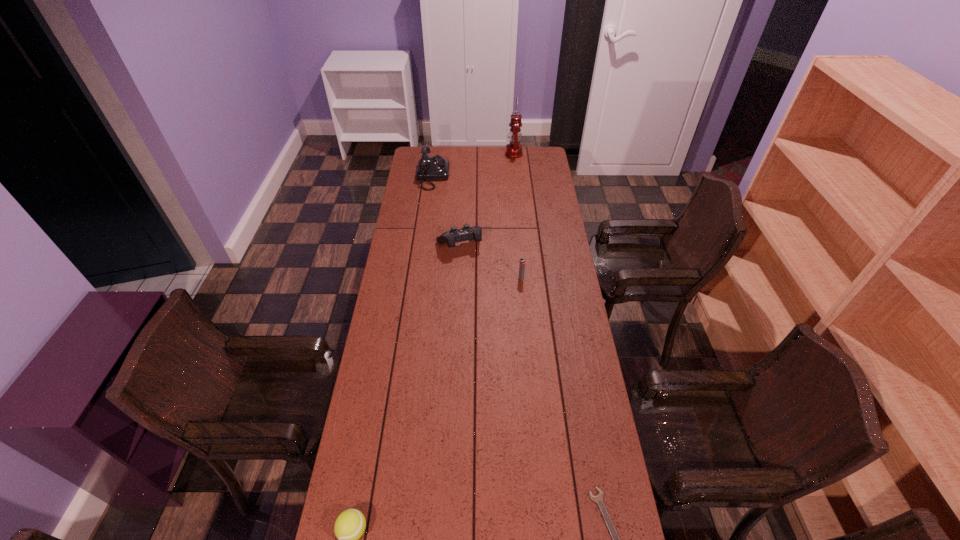
Identify the location of oil lamp. (514, 149).

Where is `the tallest object`? The height and width of the screenshot is (540, 960). the tallest object is located at coordinates (514, 149).

Find the location of a particular element. the second tallest object is located at coordinates (430, 168).

Image resolution: width=960 pixels, height=540 pixels. Identify the location of the fifth nearest object. (430, 168).

Locate an element on the screen. the third nearest object is located at coordinates (522, 262).

You are a GUI agent. You are given a task and a screenshot of the screen. Output one action in this format:
    pyautogui.click(x=<x>, y=<y>)
    Task: Click on the fourth nearest object
    The height and width of the screenshot is (540, 960).
    Given the screenshot: What is the action you would take?
    pyautogui.click(x=466, y=233)

Locate an element on the screen. vacant space located 0.160m on the left of the tallest object is located at coordinates (477, 153).

You are a GUI agent. You are given a task and a screenshot of the screen. Output one action in this format:
    pyautogui.click(x=<x>, y=<y>)
    Task: Click on the vacant space situated on the dial of the telephone
    The height and width of the screenshot is (540, 960).
    Given the screenshot: What is the action you would take?
    pyautogui.click(x=490, y=177)

Find the location of `vacant region located on the front of the third nearest object`. vacant region located on the front of the third nearest object is located at coordinates (528, 356).

Where is `vacant region located on the right of the fourth nearest object`? This screenshot has width=960, height=540. vacant region located on the right of the fourth nearest object is located at coordinates (509, 245).